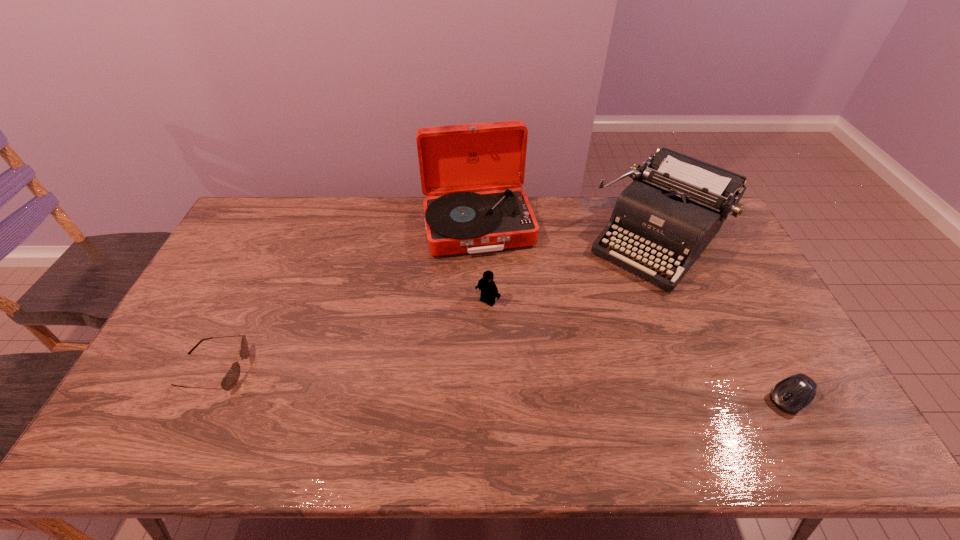
Locate an element on the screen. The image size is (960, 540). vacant space at the far left corner of the desktop is located at coordinates click(270, 202).

Image resolution: width=960 pixels, height=540 pixels. I want to click on vacant area between the mouse and the typewriter, so click(x=724, y=319).

Locate an element on the screen. Image resolution: width=960 pixels, height=540 pixels. vacant area that lies between the sunglasses and the tallest object is located at coordinates (346, 298).

Identify the location of free space between the typewriter and the phonograph_record. (568, 233).

Identify the location of free space between the mouse and the tallest object. The width and height of the screenshot is (960, 540). (634, 312).

Locate an element on the screen. Image resolution: width=960 pixels, height=540 pixels. free space between the typewriter and the tallest object is located at coordinates [568, 233].

Locate an element on the screen. The height and width of the screenshot is (540, 960). vacant space in between the phonograph_record and the mouse is located at coordinates (634, 312).

The height and width of the screenshot is (540, 960). In order to click on free space between the third shortest object and the typewriter in this screenshot , I will do [x=573, y=271].

Identify the location of free area in between the second tallest object and the mouse. (724, 319).

Identify the location of free space between the mouse and the tallest object. (634, 312).